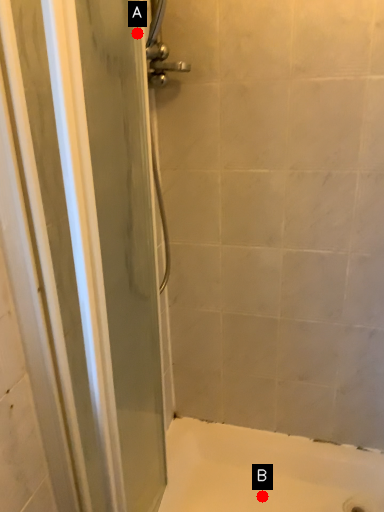
Question: Two points are circled on the image, labeled by A and B beside each circle. Which point is farther to the camera?

Choices:
 (A) A is further
 (B) B is further

Answer: (B)